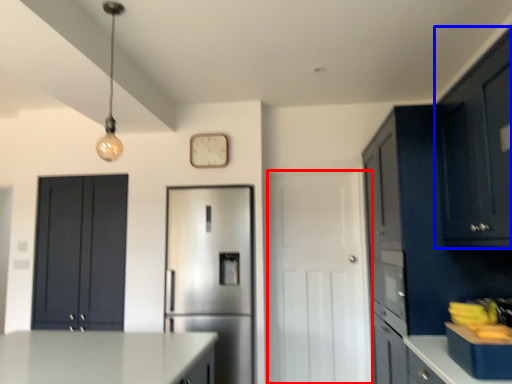
Question: Which of the following is the closest to the observer, door (highlighted by a red box) or cabinetry (highlighted by a blue box)?

Choices:
 (A) door
 (B) cabinetry

Answer: (B)